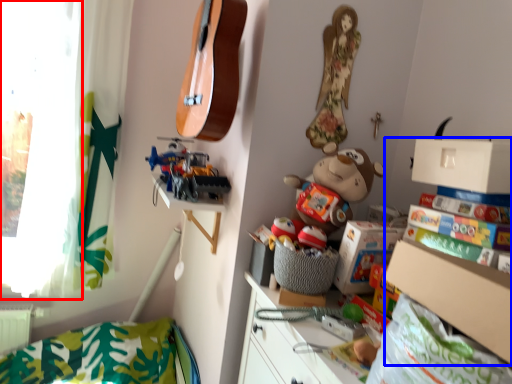
Question: Which of the following is the closest to the observer, window screen (highlighted by a red box) or shelf (highlighted by a blue box)?

Choices:
 (A) window screen
 (B) shelf

Answer: (B)